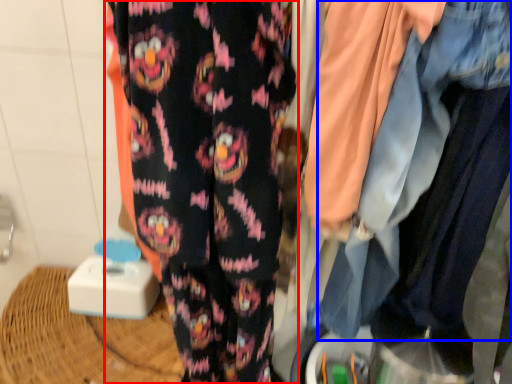
Question: Which object is closer to the camera taking this photo, trousers (highlighted by a red box) or denim jacket (highlighted by a blue box)?

Choices:
 (A) trousers
 (B) denim jacket

Answer: (B)